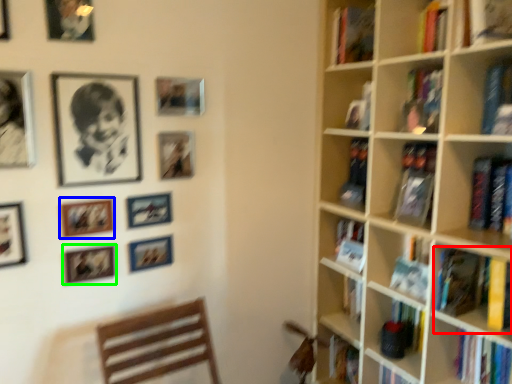
Question: Estimate the real-world distances between objects in this image. Which object is closer to book (highlighted by a red box), picture frame (highlighted by a blue box) or picture frame (highlighted by a green box)?

Choices:
 (A) picture frame
 (B) picture frame

Answer: (B)